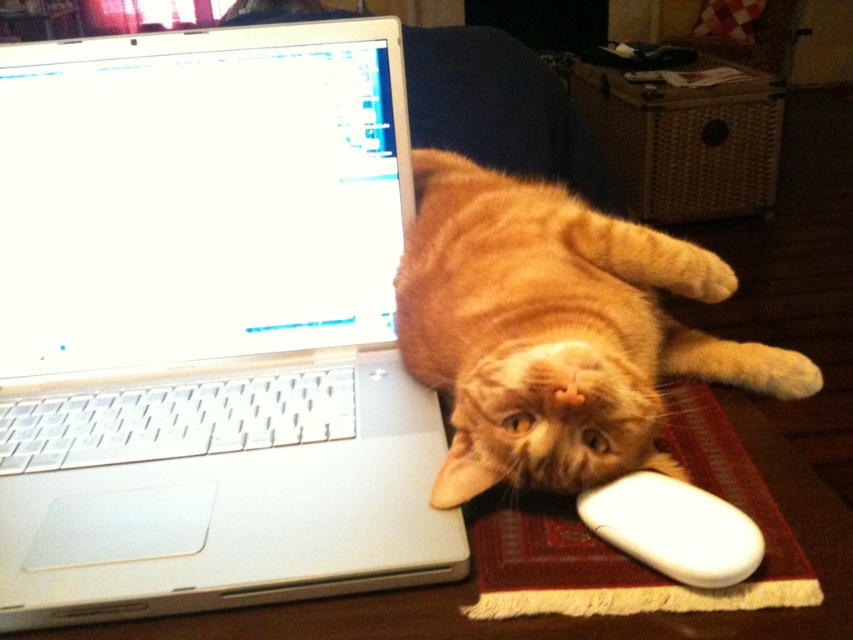
From the picture: You are organizing a space for a small robot that needs to move around without bumping into objects. The robot is 12 centimeters wide. You see the silver metallic laptop at upper left and the white matte mouse at lower right. Which object should the robot avoid to ensure it has enough space to move freely?

The silver metallic laptop at upper left is larger in size than the white matte mouse at lower right, so the robot should avoid the silver metallic laptop at upper left to ensure enough space to move freely.

You need to place a new keyboard that is the same size as the white matte mouse at lower right on the rug. Can the silver metallic laptop at upper left fit on the rug without overlapping the mouse?

The silver metallic laptop at upper left is wider than the white matte mouse at lower right. Since the keyboard will be the same size as the mouse, the laptop can fit on the rug without overlapping the mouse as it is larger and there is enough space.